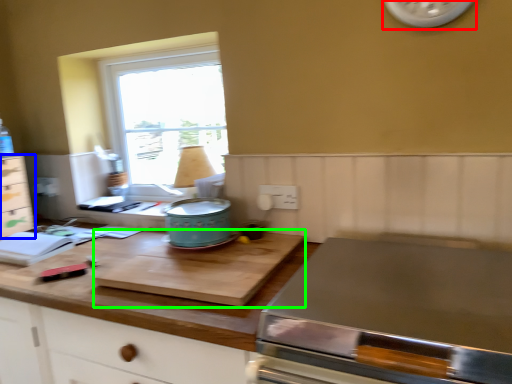
Question: Which object is the farthest from clock (highlighted by a red box)? Choose among these: cabinetry (highlighted by a blue box) or cutting board (highlighted by a green box).

Choices:
 (A) cabinetry
 (B) cutting board

Answer: (A)